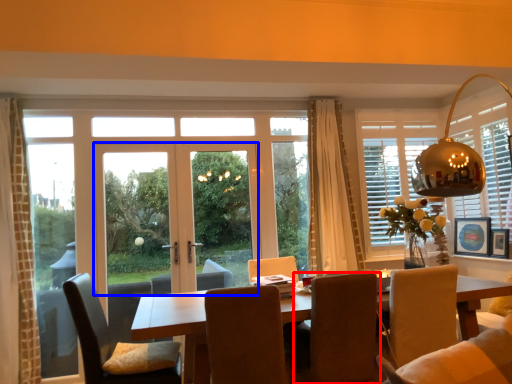
Question: Which of the following is the closest to the observer, chair (highlighted by a red box) or door (highlighted by a blue box)?

Choices:
 (A) chair
 (B) door

Answer: (A)